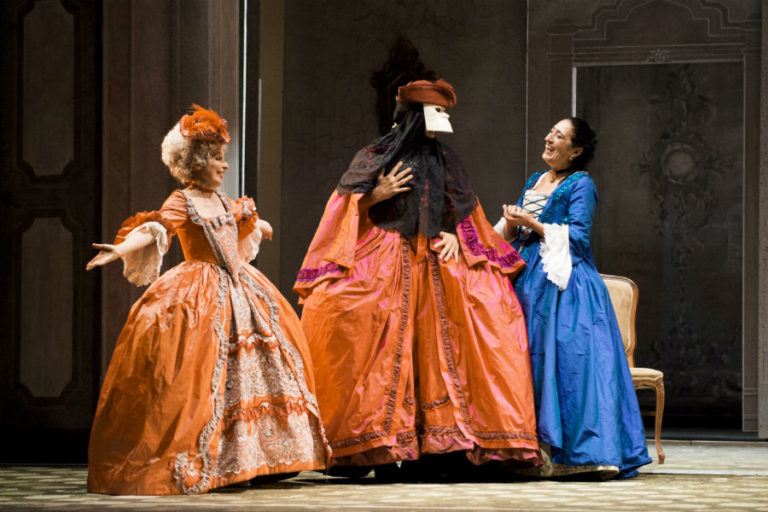
Identify the location of floor. (505, 508).